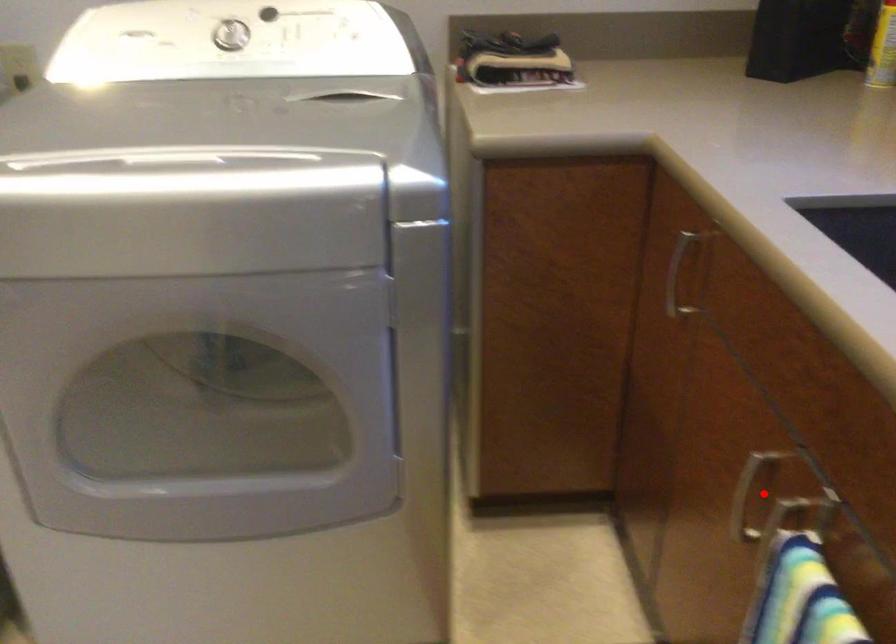
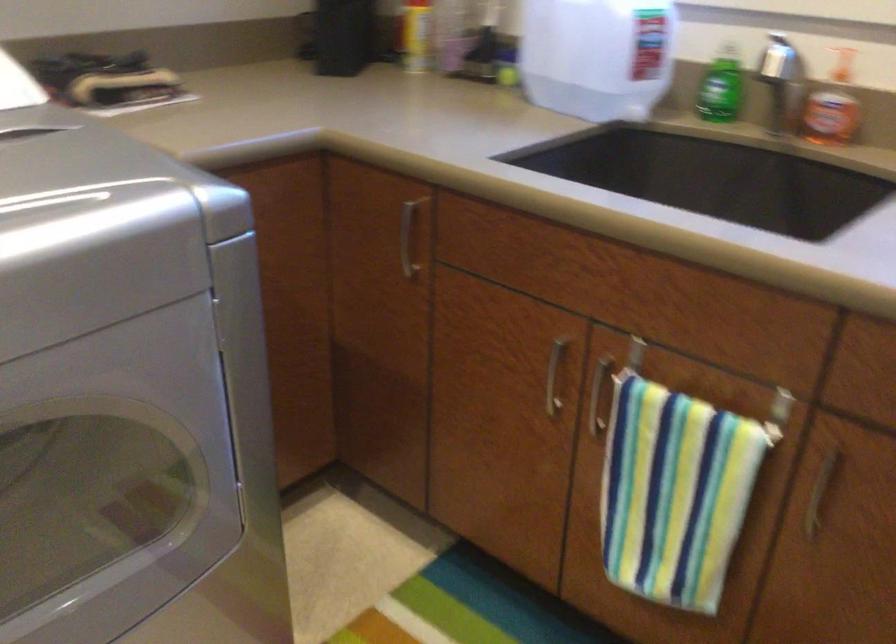
Question: A red point is marked in image1. In image2, is the corresponding 3D point closer to the camera or farther? Reply with the corresponding letter.

Choices:
 (A) The corresponding 3D point is closer.
 (B) The corresponding 3D point is farther.

Answer: (B)